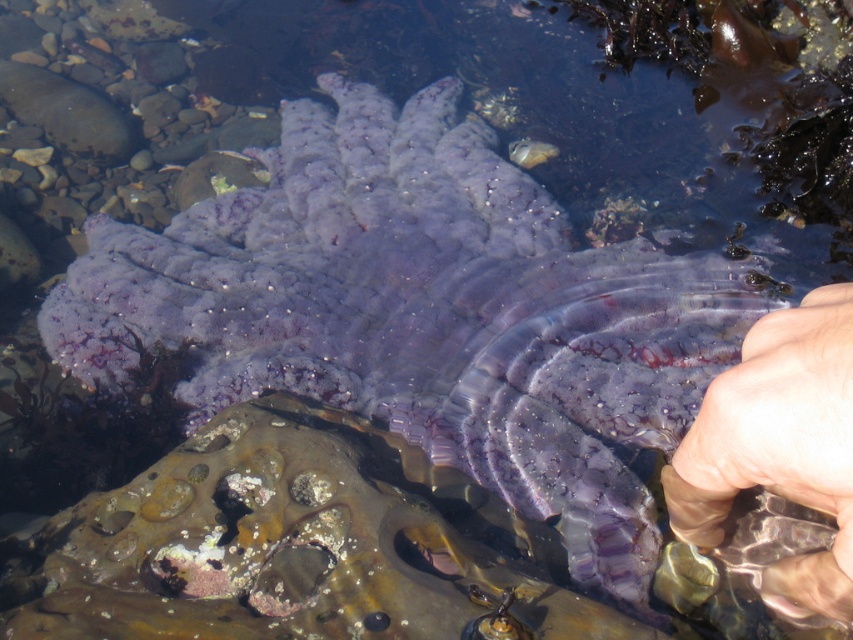
Question: Can you confirm if pale skin/fleshy hand at lower right is positioned to the right of translucent rubber fish at center?

Choices:
 (A) yes
 (B) no

Answer: (A)

Question: Can you confirm if pale skin/fleshy hand at lower right is smaller than translucent rubber fish at center?

Choices:
 (A) yes
 (B) no

Answer: (B)

Question: Among these objects, which one is farthest from the camera?

Choices:
 (A) translucent rubber fish at center
 (B) pale skin/fleshy hand at lower right

Answer: (A)

Question: In this image, where is pale skin/fleshy hand at lower right located relative to translucent rubber fish at center?

Choices:
 (A) right
 (B) left

Answer: (A)

Question: Which object appears closest to the camera in this image?

Choices:
 (A) translucent rubber fish at center
 (B) pale skin/fleshy hand at lower right

Answer: (B)